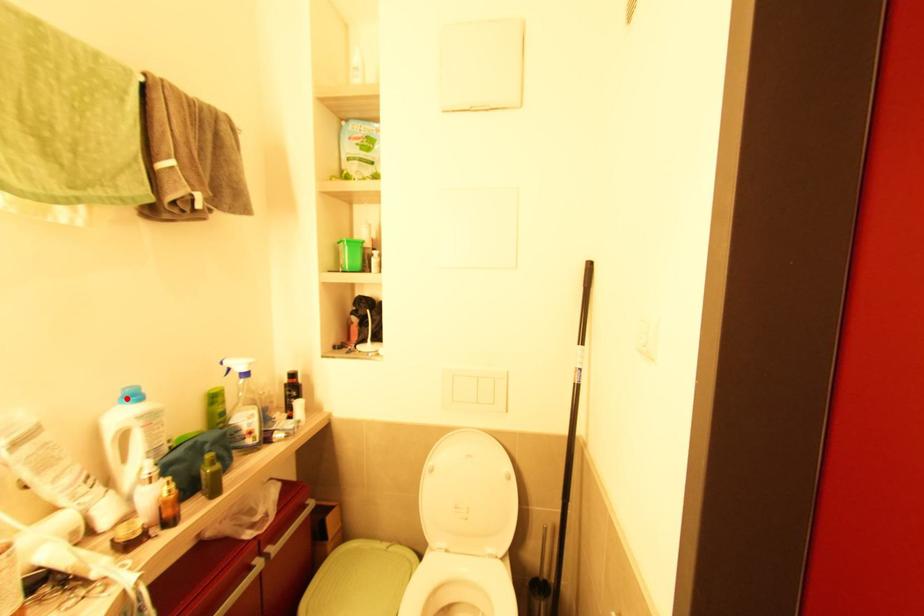
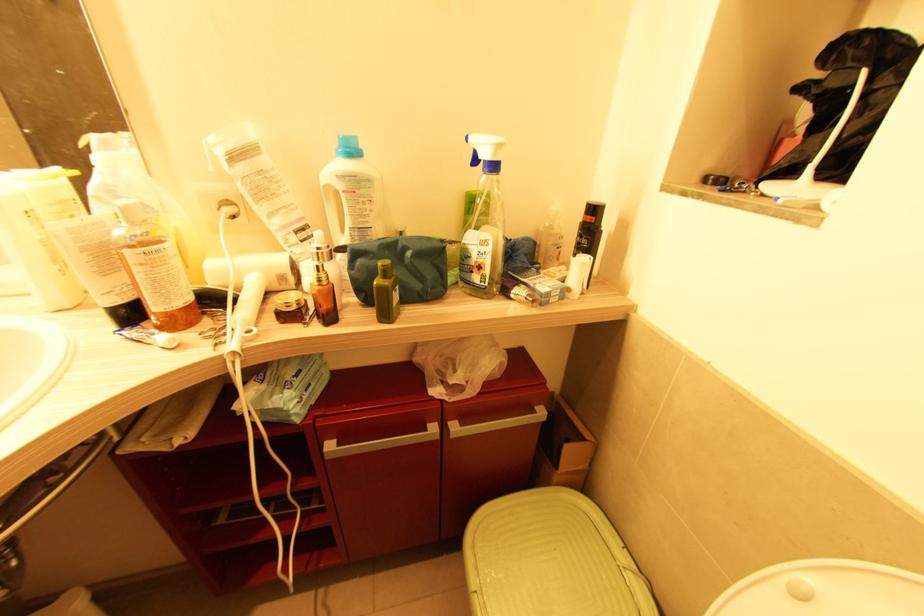
Find the pixel in the second image that matches the highlighted location in the first image.

(341, 148)